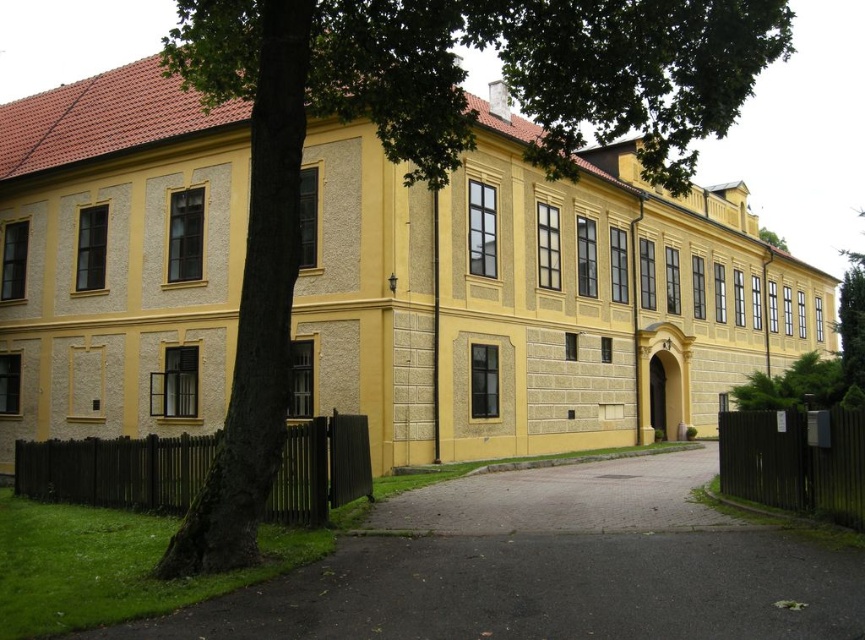
Does black asphalt driveway at lower center have a greater width compared to gray asphalt driveway at center?

No.

Measure the distance between point (465, 618) and camera.

The distance of point (465, 618) from camera is 7.13 meters.

In order to click on black asphalt driveway at lower center in this screenshot , I will do `click(548, 566)`.

Does green leafy tree at center appear on the right side of green leafy tree at upper right?

Incorrect, green leafy tree at center is not on the right side of green leafy tree at upper right.

Measure the distance between point (665, 164) and camera.

Point (665, 164) is 16.06 meters away from camera.

Identify the location of green leafy tree at center. The image size is (865, 640). (427, 147).

Is green leafy tree at center thinner than gray asphalt driveway at center?

No.

Which is more to the right, green leafy tree at center or gray asphalt driveway at center?

From the viewer's perspective, gray asphalt driveway at center appears more on the right side.

Describe the element at coordinates (427, 147) in the screenshot. I see `green leafy tree at center` at that location.

This screenshot has width=865, height=640. Identify the location of green leafy tree at center. (427, 147).